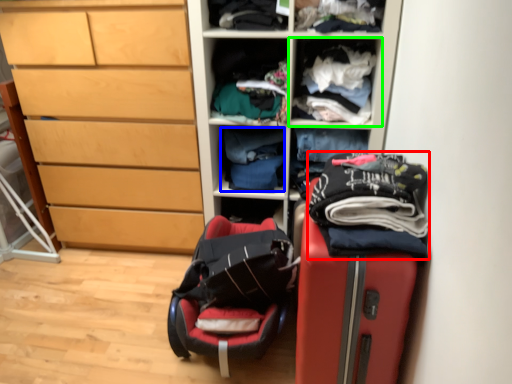
Question: Which object is positioned closest to clothing (highlighted by a red box)? Select from clothing (highlighted by a blue box) and shelf (highlighted by a green box).

Choices:
 (A) clothing
 (B) shelf

Answer: (B)